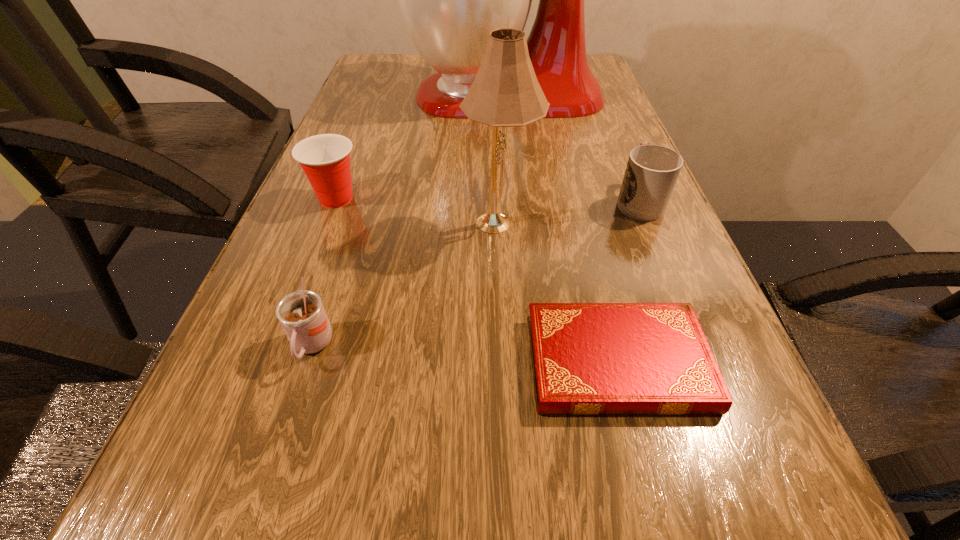
Where is `blank region between the second tallest object and the shortest object`? Image resolution: width=960 pixels, height=540 pixels. blank region between the second tallest object and the shortest object is located at coordinates (559, 292).

You are a GUI agent. You are given a task and a screenshot of the screen. Output one action in this format:
    pyautogui.click(x=<x>, y=<y>)
    Task: Click on the closest object to the lampshade
    
    Given the screenshot: What is the action you would take?
    pyautogui.click(x=652, y=171)

At what (x,y) coordinates should I click in order to perform the action: click on object that is the second closest to the nearest cup. Please return your answer as a coordinate pair (x, y). The image size is (960, 540). Looking at the image, I should click on (325, 158).

Select which cup appears as the closest to the rightmost cup. Please provide its 2D coordinates. Your answer should be formatted as a tuple, i.e. [(x, y)], where the tuple contains the x and y coordinates of a point satisfying the conditions above.

[(325, 158)]

Locate an element on the screen. the third closest cup to the mixer is located at coordinates click(x=301, y=314).